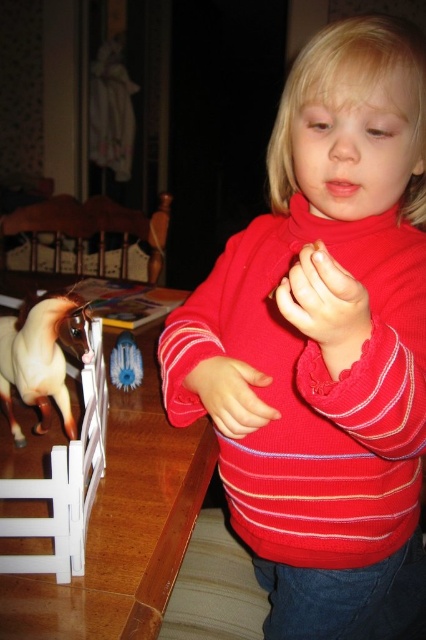
You are a parent trying to clean up the play area. You see the brown wooden table at lower left and the brown glossy horse at left. Which object is closer to the floor?

The brown glossy horse at left is closer to the floor because the brown wooden table at lower left is located above it.

You are a photographer trying to capture a shot of the child and their belongings. You need to ensure the red striped sweater at center and the brown glossy horse at left are both in frame. Based on their positions, which object is closer to the left edge of the image?

The brown glossy horse at left is closer to the left edge of the image because the red striped sweater at center is positioned on the right side of it.